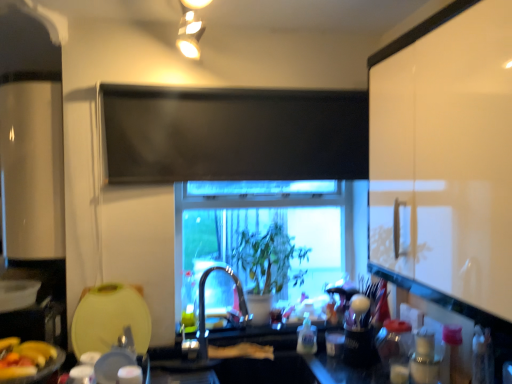
Question: Would you say white glossy cabinet at right is to the left or to the right of translucent plastic bottle at center, the 2th bottle when ordered from front to back, in the picture?

Choices:
 (A) left
 (B) right

Answer: (B)

Question: Do you think white glossy cabinet at right is within translucent plastic bottle at center, the 2th bottle in the right-to-left sequence, or outside of it?

Choices:
 (A) inside
 (B) outside

Answer: (B)

Question: Which object is positioned farthest from the transparent glass window at center?

Choices:
 (A) white glossy cabinet at right
 (B) matte plastic toothbrush holder at lower right
 (C) yellow matte bananas at lower left
 (D) matte gold light fixture at upper center
 (E) satin nickel faucet at center

Answer: (C)

Question: Which is nearer to the translucent plastic bottle at center, the 2th bottle when ordered from front to back?

Choices:
 (A) green matte plant at center
 (B) matte plastic toothbrush holder at lower right
 (C) yellow matte bananas at lower left
 (D) translucent plastic bottle at right, which is the 1th bottle in right-to-left order
 (E) white glossy cabinet at right

Answer: (B)